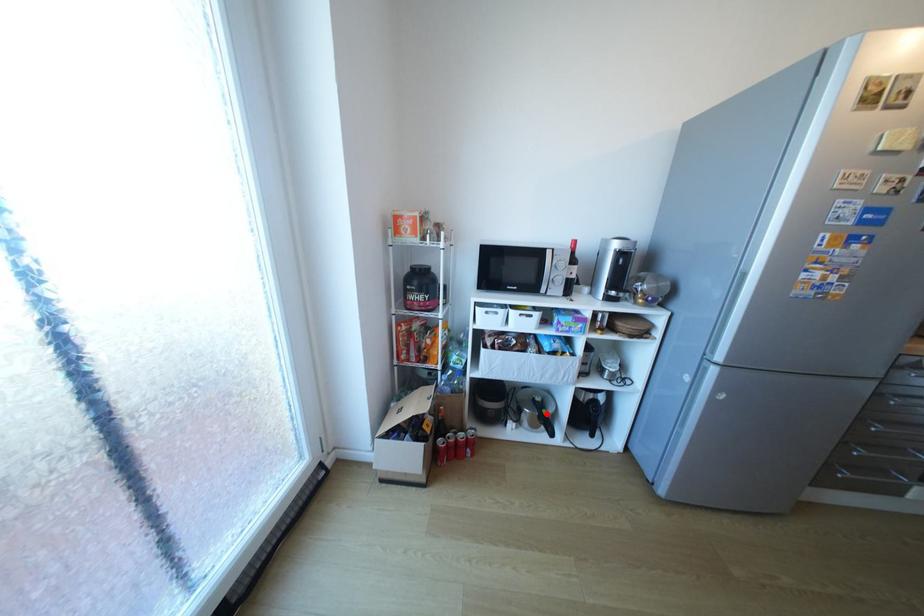
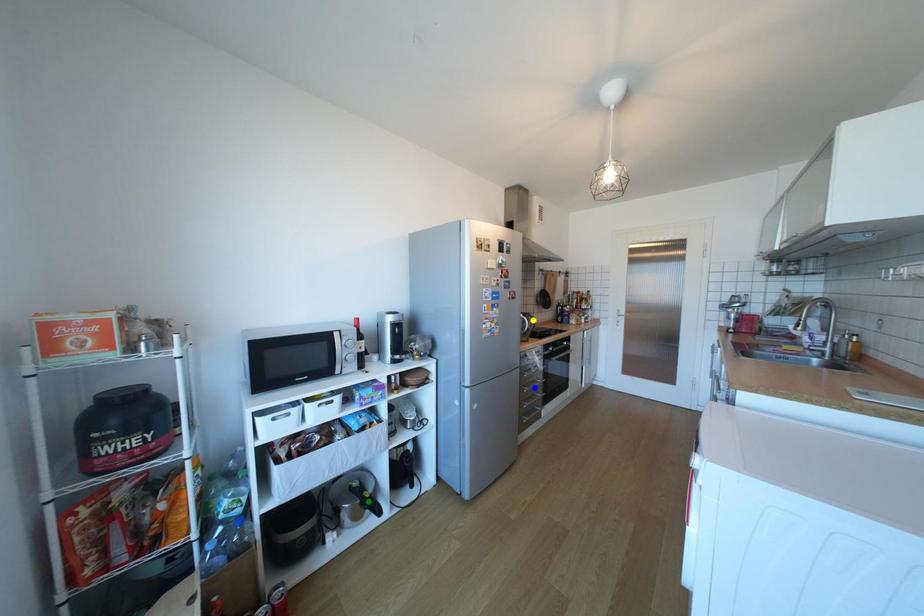
Question: I am providing you with two images of the same scene from different viewpoints. A red point is marked on the first image. You are given multiple points on the second image. In image 2, which mark is for the same physical point as the one in image 1?

Choices:
 (A) green point
 (B) blue point
 (C) yellow point

Answer: (A)